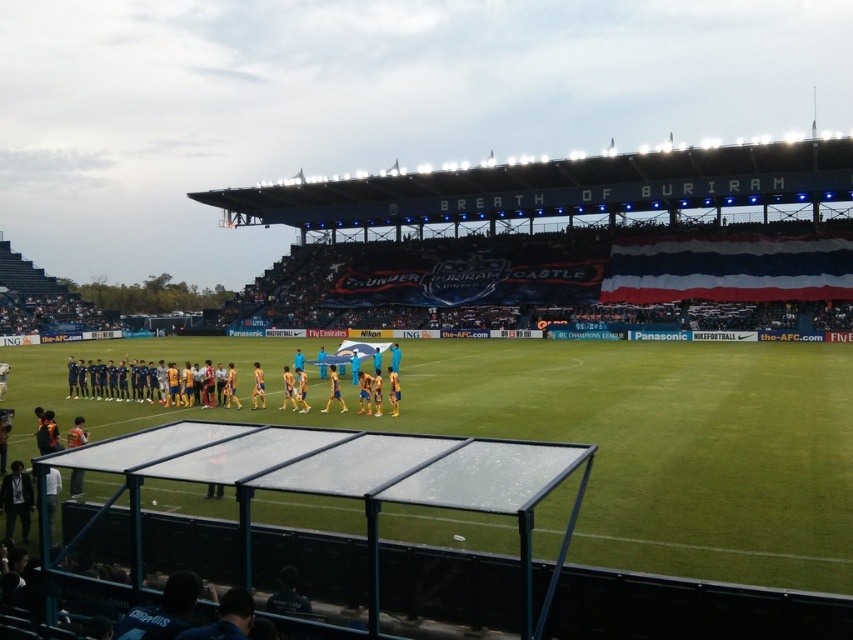
Does green grass football field at center appear on the left side of dark blue jersey at center?

Incorrect, green grass football field at center is not on the left side of dark blue jersey at center.

The height and width of the screenshot is (640, 853). What do you see at coordinates (583, 435) in the screenshot?
I see `green grass football field at center` at bounding box center [583, 435].

Locate an element on the screen. green grass football field at center is located at coordinates (583, 435).